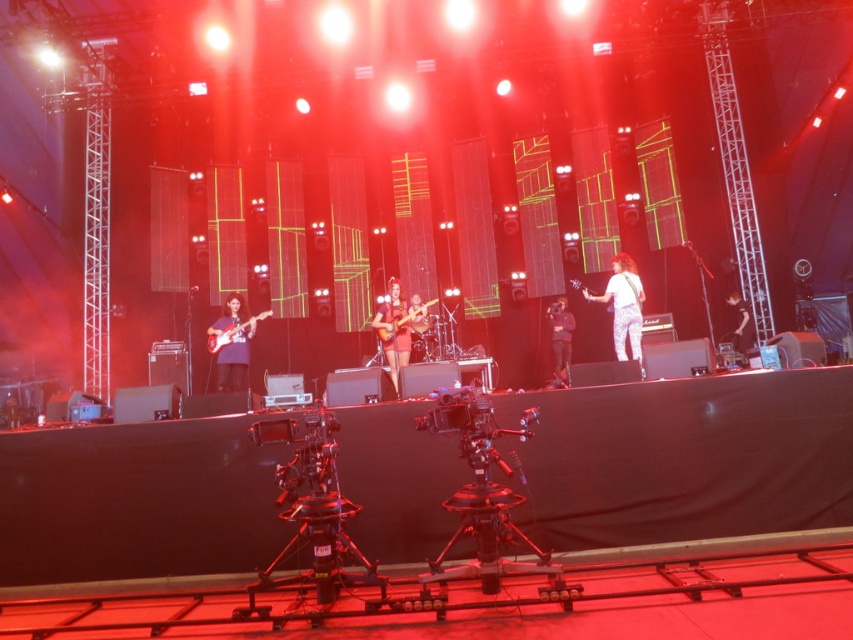
Who is positioned more to the right, shiny black guitar at center or matte black electric guitar at left?

Positioned to the right is shiny black guitar at center.

Measure the distance between point (563, 317) and camera.

Point (563, 317) is 32.52 feet from camera.

Is point (550, 304) positioned in front of point (230, 339)?

No, it is not.

At what (x,y) coordinates should I click in order to perform the action: click on shiny black guitar at center. Please return your answer as a coordinate pair (x, y). Looking at the image, I should click on (560, 339).

Is matte purple guitar at left smaller than shiny black guitar at center?

Indeed, matte purple guitar at left has a smaller size compared to shiny black guitar at center.

Between point (229, 356) and point (556, 380), which one is positioned behind?

The point (229, 356) is more distant.

You are a GUI agent. You are given a task and a screenshot of the screen. Output one action in this format:
    pyautogui.click(x=<x>, y=<y>)
    Task: Click on the matte purple guitar at left
    This screenshot has height=640, width=853.
    Given the screenshot: What is the action you would take?
    pyautogui.click(x=231, y=342)

Can you confirm if matte purple guitar at left is taller than matte black electric guitar at left?

Yes, matte purple guitar at left is taller than matte black electric guitar at left.

Is matte purple guitar at left to the left of matte black electric guitar at left from the viewer's perspective?

In fact, matte purple guitar at left is to the right of matte black electric guitar at left.

The height and width of the screenshot is (640, 853). Find the location of `matte purple guitar at left`. matte purple guitar at left is located at coordinates (231, 342).

Where is `matte purple guitar at left`? matte purple guitar at left is located at coordinates (231, 342).